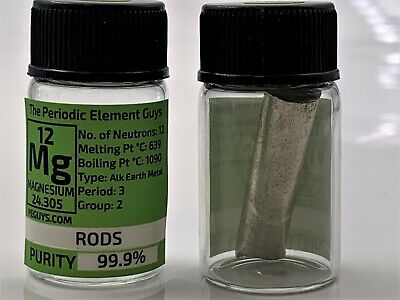
Identify the location of table. (365, 281).